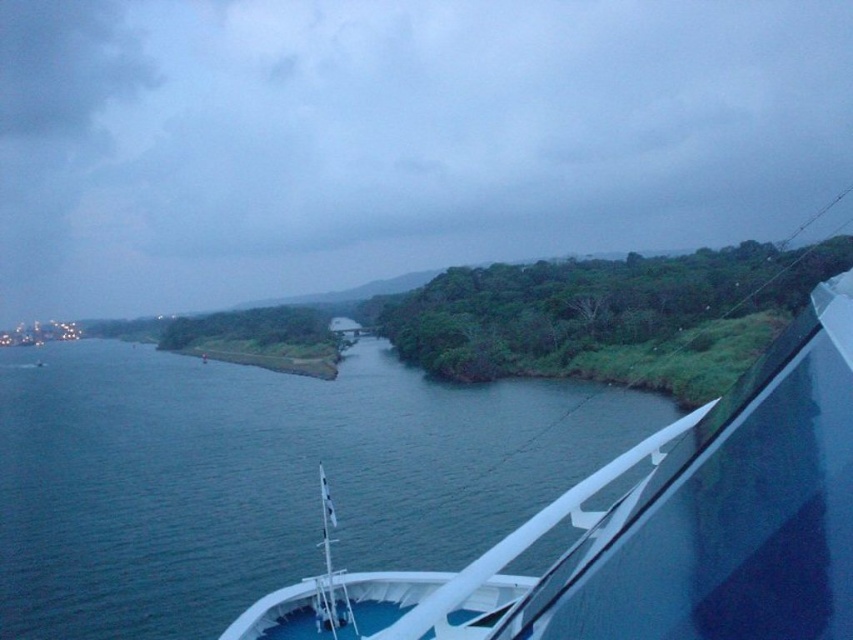
You are standing on the deck of the ship and want to take a photo of the white glossy boat at center. Which direction should you move to ensure the blue water at lower left appears to the left of the boat in your photo?

You should move to your left so that the blue water at lower left is positioned to the left of the white glossy boat at center in your photo.

You are standing on the ship deck and want to take a photo of the blue water at lower left. Where should you position yourself to capture it in the frame?

The blue water at lower left is located at point (260, 477), so you should position yourself towards the lower left area of the deck to capture it in the frame.